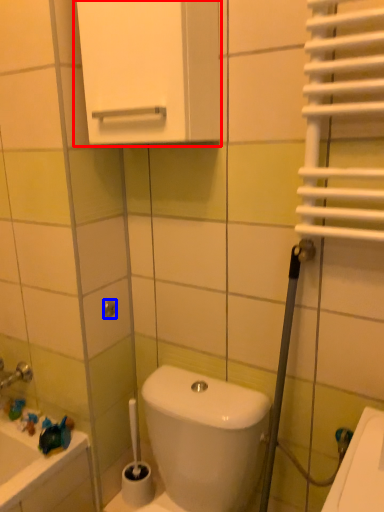
Question: Among these objects, which one is nearest to the camera, medicine cabinet (highlighted by a red box) or shower (highlighted by a blue box)?

Choices:
 (A) medicine cabinet
 (B) shower

Answer: (A)